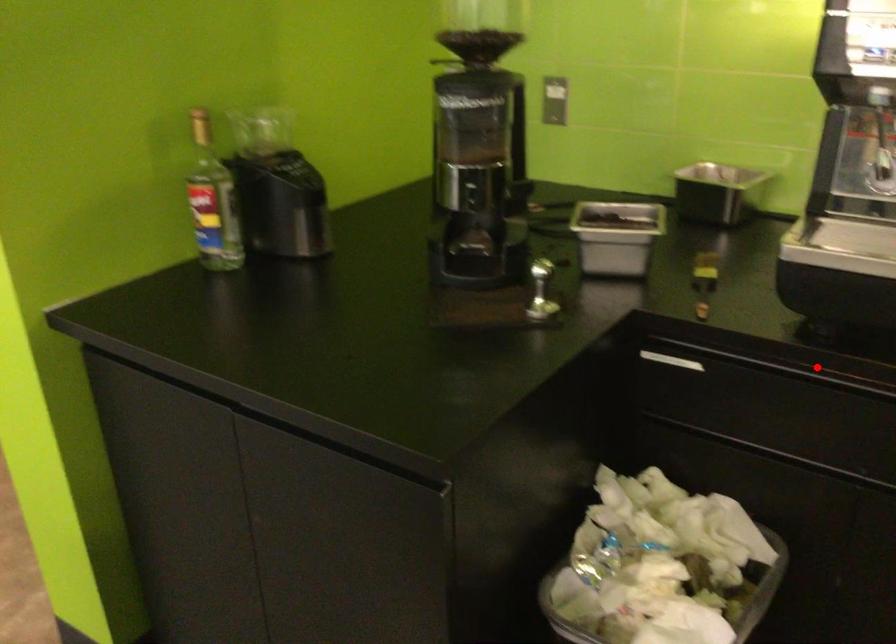
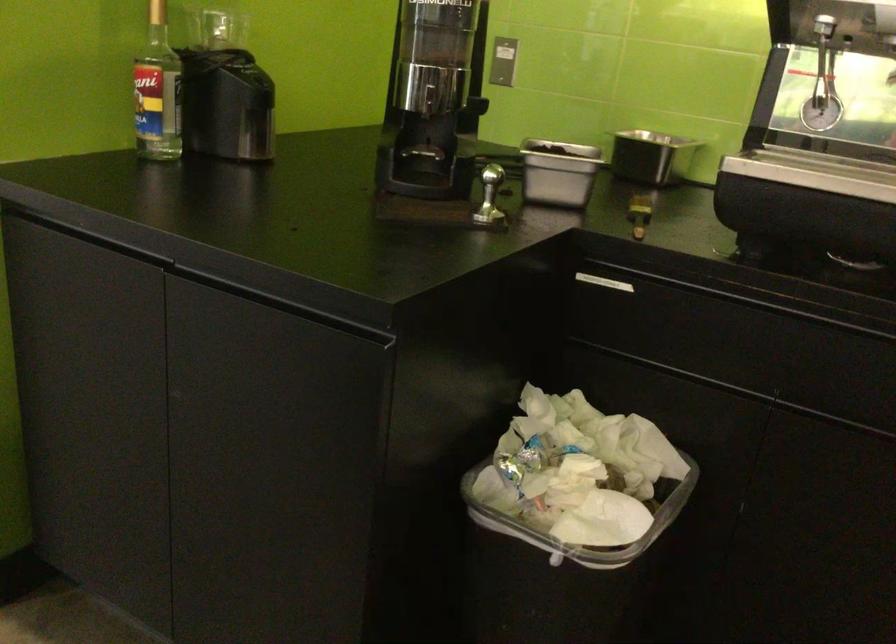
Where in the second image is the point corresponding to the highlighted location from the first image?

(744, 287)